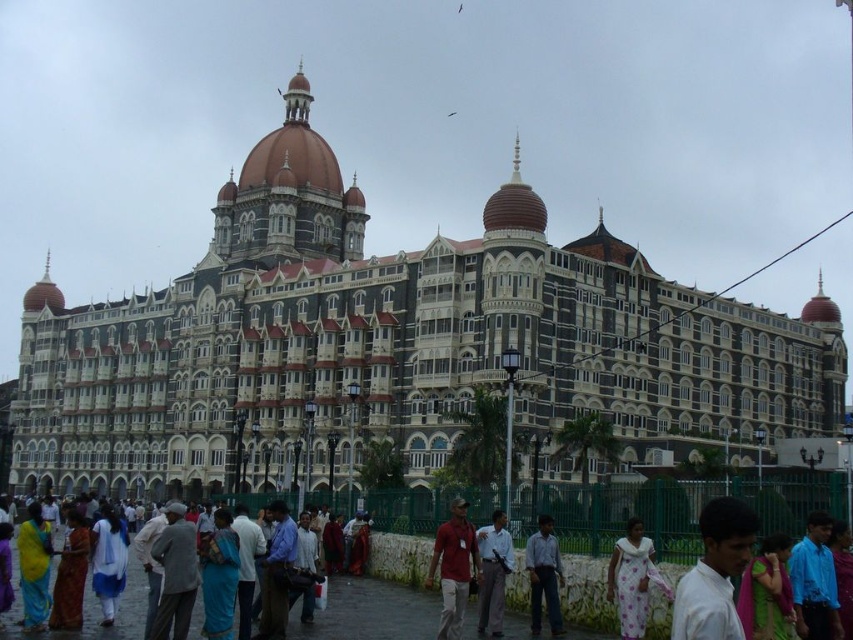
Is blue shirt at center positioned behind white cotton shirt at center?

No, blue shirt at center is closer to the viewer.

Between point (815, 620) and point (498, 595), which one is positioned in front?

Positioned in front is point (815, 620).

Is point (799, 625) closer to camera compared to point (503, 518)?

That is True.

I want to click on blue shirt at center, so click(814, 580).

Who is lower down, white floral dress at lower center or matte yellow sari at lower left?

white floral dress at lower center is below.

Consider the image. Does white floral dress at lower center have a greater height compared to matte yellow sari at lower left?

Incorrect, white floral dress at lower center's height is not larger of matte yellow sari at lower left's.

Identify the location of white floral dress at lower center. (631, 579).

Between blue shirt at center and light blue shirt at center, which one appears on the left side from the viewer's perspective?

light blue shirt at center

Is point (805, 596) farther from viewer compared to point (552, 536)?

No.

Find the location of a particular element. This screenshot has height=640, width=853. blue shirt at center is located at coordinates (814, 580).